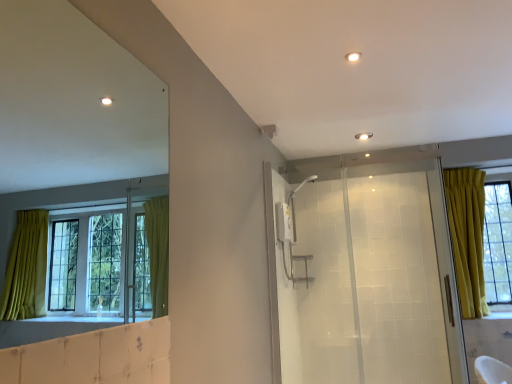
Question: Is transparent glass shower door at center in front of or behind white glossy light at upper center in the image?

Choices:
 (A) front
 (B) behind

Answer: (B)

Question: Do you think transparent glass shower door at center is within white glossy light at upper center, or outside of it?

Choices:
 (A) outside
 (B) inside

Answer: (A)

Question: Would you say transparent glass shower door at center is to the left or to the right of white glossy light at upper center in the picture?

Choices:
 (A) right
 (B) left

Answer: (A)

Question: Looking at their shapes, would you say white glossy light at upper center is wider or thinner than transparent glass shower door at center?

Choices:
 (A) wide
 (B) thin

Answer: (A)

Question: From a real-world perspective, is white glossy light at upper center above or below transparent glass shower door at center?

Choices:
 (A) below
 (B) above

Answer: (B)

Question: Is white glossy light at upper center to the left or to the right of transparent glass shower door at center in the image?

Choices:
 (A) left
 (B) right

Answer: (A)

Question: From the image's perspective, relative to transparent glass shower door at center, is white glossy light at upper center above or below?

Choices:
 (A) below
 (B) above

Answer: (B)